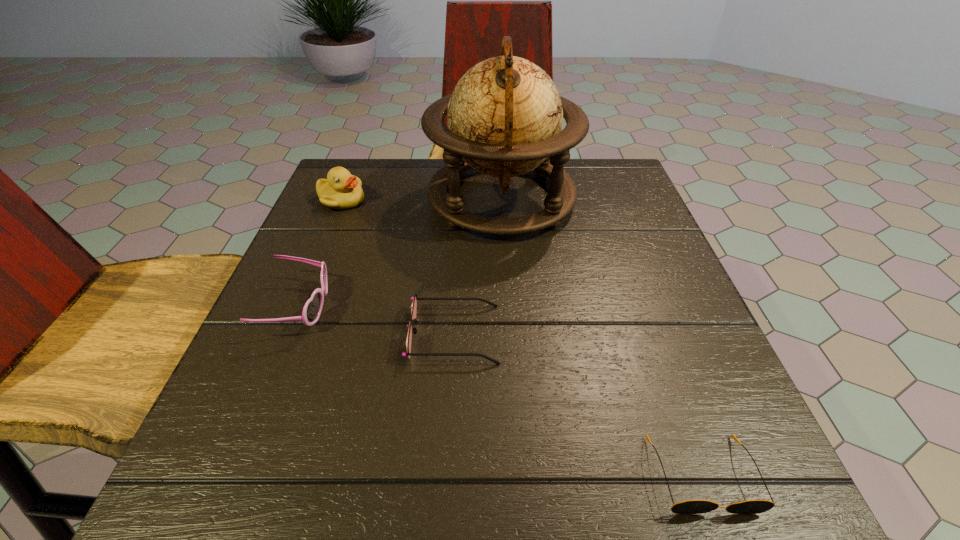
This screenshot has height=540, width=960. Find the location of `object located at the near right corner`. object located at the near right corner is located at coordinates (690, 506).

You are a GUI agent. You are given a task and a screenshot of the screen. Output one action in this format:
    pyautogui.click(x=<x>, y=<y>)
    Task: Click on the free space at the far edge
    The image size is (960, 540).
    Given the screenshot: What is the action you would take?
    pyautogui.click(x=468, y=209)

Find the location of a particular element. The height and width of the screenshot is (540, 960). vacant space at the left edge is located at coordinates (341, 223).

The height and width of the screenshot is (540, 960). In order to click on vacant region at the right edge of the desktop in this screenshot , I will do `click(657, 293)`.

In the image, there is a desktop. At what (x,y) coordinates should I click in order to perform the action: click on free region at the far left corner. Please return your answer as a coordinate pair (x, y). The width and height of the screenshot is (960, 540). Looking at the image, I should click on (366, 196).

The width and height of the screenshot is (960, 540). I want to click on free spot at the far right corner of the desktop, so click(629, 210).

The height and width of the screenshot is (540, 960). Identify the location of vacant space that's between the second sunglasses from left to right and the globe. (478, 266).

Locate an element on the screen. This screenshot has height=540, width=960. free space between the second sunglasses from left to right and the third shortest object is located at coordinates coord(376,320).

I want to click on vacant area that lies between the tallest sunglasses and the second sunglasses from left to right, so click(376, 320).

I want to click on free space between the duckling and the tallest sunglasses, so click(x=320, y=253).